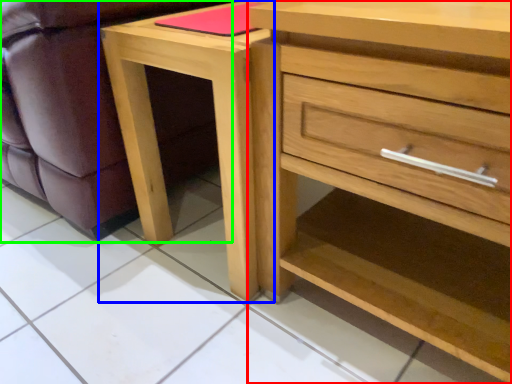
Question: Which is farther away from chest of drawers (highlighted by a red box)? nightstand (highlighted by a blue box) or swivel chair (highlighted by a green box)?

Choices:
 (A) nightstand
 (B) swivel chair

Answer: (B)